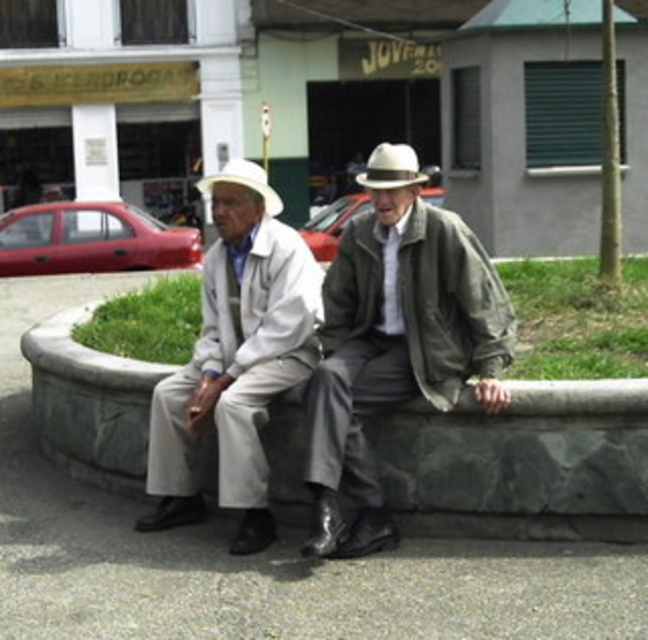
Is gray stone curb at center thinner than white matte cowboy hat at center?

Correct, gray stone curb at center's width is less than white matte cowboy hat at center's.

Locate an element on the screen. The width and height of the screenshot is (648, 640). gray stone curb at center is located at coordinates (522, 464).

Between matte gray coat at center and white felt fedora at center, which one appears on the right side from the viewer's perspective?

Positioned to the right is white felt fedora at center.

Is matte gray coat at center to the right of white felt fedora at center from the viewer's perspective?

No, matte gray coat at center is not to the right of white felt fedora at center.

The image size is (648, 640). Describe the element at coordinates (395, 349) in the screenshot. I see `matte gray coat at center` at that location.

Find the location of a particular element. This screenshot has width=648, height=640. matte gray coat at center is located at coordinates (395, 349).

Who is shorter, light beige fabric coat at center or white felt fedora at center?

Standing shorter between the two is light beige fabric coat at center.

Between point (294, 385) and point (413, 179), which one is positioned behind?

Point (294, 385)

In order to click on light beige fabric coat at center in this screenshot , I will do `click(235, 356)`.